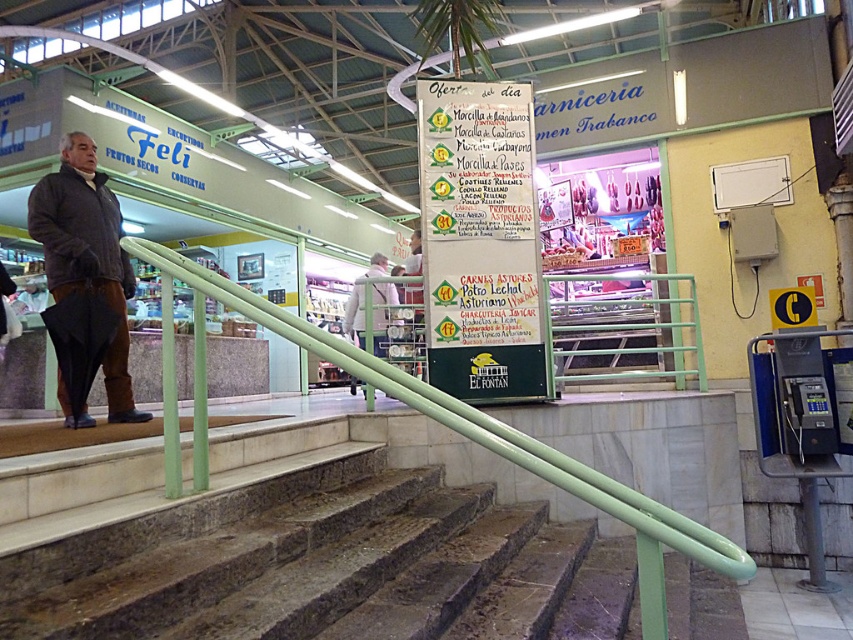
Question: Does green marble stairs at center appear on the left side of light gray fabric jacket at center?

Choices:
 (A) yes
 (B) no

Answer: (B)

Question: Which point is farther from the camera taking this photo?

Choices:
 (A) (387, 509)
 (B) (107, 204)

Answer: (B)

Question: Is dark gray jacket at left closer to camera compared to light gray fabric jacket at center?

Choices:
 (A) no
 (B) yes

Answer: (B)

Question: Which point appears closest to the camera in this image?

Choices:
 (A) (201, 508)
 (B) (112, 374)
 (C) (349, 298)

Answer: (A)

Question: Does dark gray jacket at left have a lesser width compared to light gray fabric jacket at center?

Choices:
 (A) no
 (B) yes

Answer: (B)

Question: Which object is positioned farthest from the light gray fabric jacket at center?

Choices:
 (A) green marble stairs at center
 (B) dark gray jacket at left

Answer: (A)